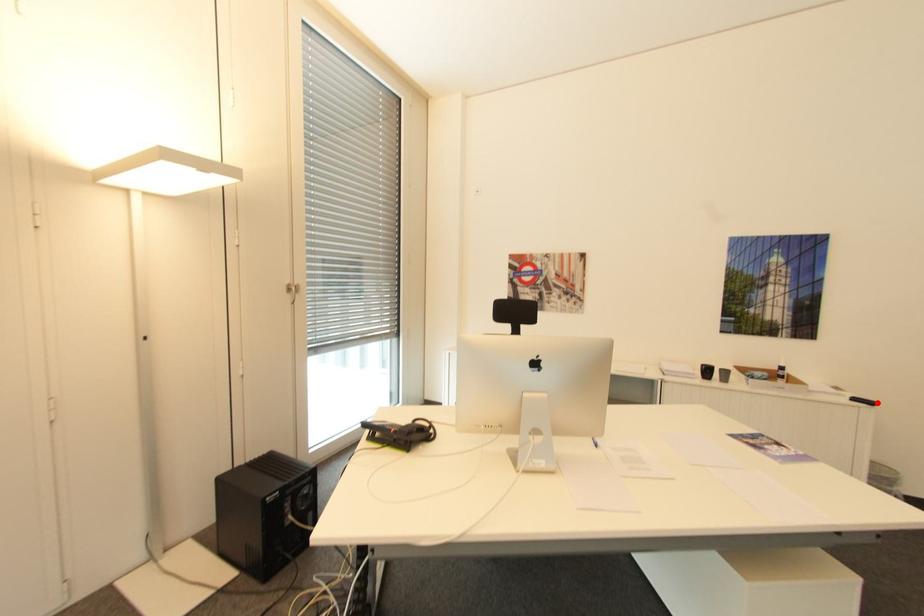
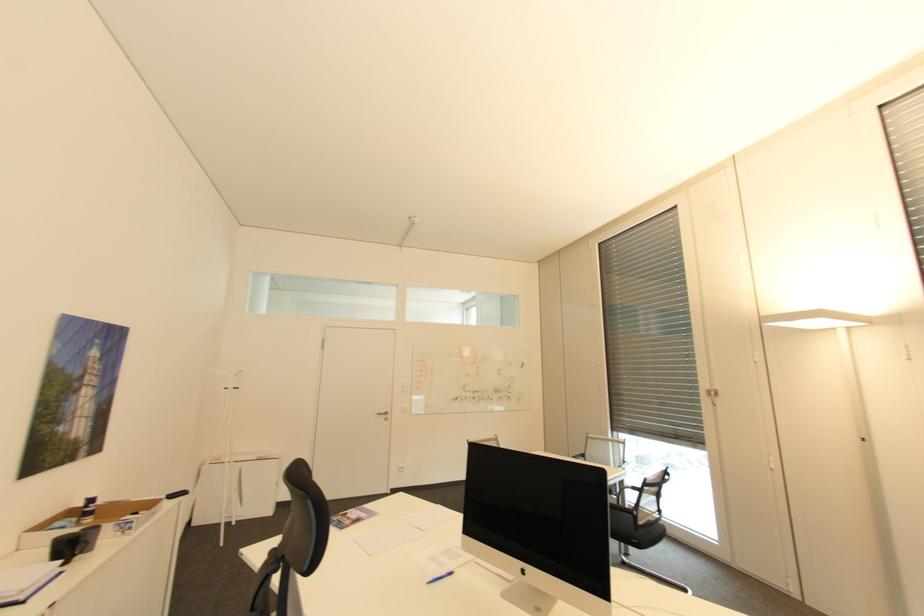
Question: I am providing you with two images of the same scene from different viewpoints. In image1, a red point is highlighted. Considering the same 3D point in image2, which of the following is correct?

Choices:
 (A) It is closer
 (B) It is farther

Answer: (B)